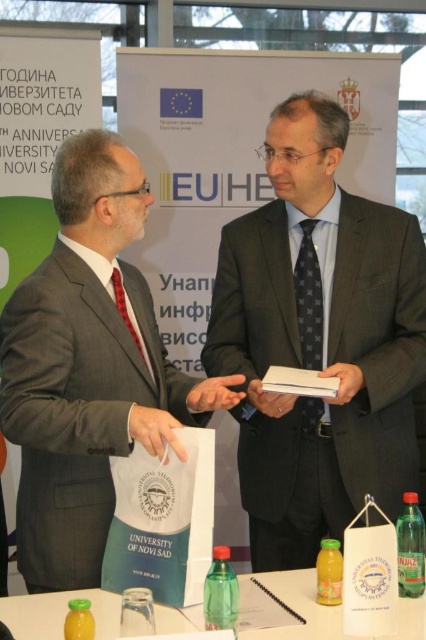
Question: Can you confirm if dark gray suit at center is wider than translucent plastic bottle at lower center?

Choices:
 (A) no
 (B) yes

Answer: (B)

Question: Does translucent plastic bottle at lower center appear on the left side of matte black book at center?

Choices:
 (A) yes
 (B) no

Answer: (B)

Question: Which point is farther to the camera?

Choices:
 (A) matte white paper at center
 (B) translucent plastic bottle at lower left

Answer: (A)

Question: Is dark gray suit at center above matte black book at center?

Choices:
 (A) no
 (B) yes

Answer: (B)

Question: Which point appears closest to the camera in this image?

Choices:
 (A) (256, 534)
 (B) (328, 401)
 (C) (317, 593)

Answer: (C)

Question: Which point is closer to the camera taking this photo?

Choices:
 (A) (221, 288)
 (B) (31, 502)
 (C) (25, 600)

Answer: (C)